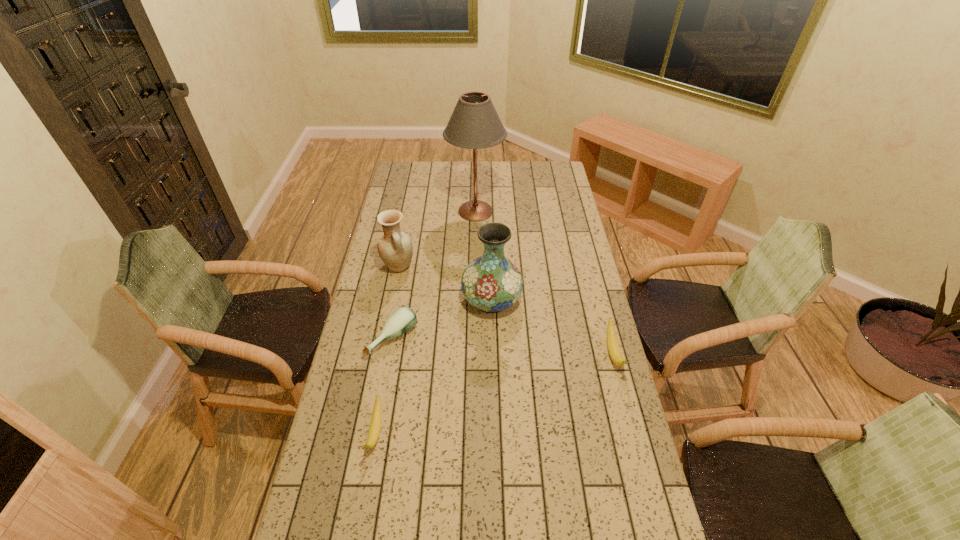
At what (x,y) coordinates should I click in order to perform the action: click on free space at the left edge of the desktop. Please return your answer as a coordinate pair (x, y). Looking at the image, I should click on pyautogui.click(x=365, y=295).

Identify the location of vacant region at the right edge. The image size is (960, 540). (636, 466).

In the image, there is a desktop. At what (x,y) coordinates should I click in order to perform the action: click on vacant space at the far left corner. Please return your answer as a coordinate pair (x, y). This screenshot has height=540, width=960. Looking at the image, I should click on (401, 170).

Locate an element on the screen. vacant space at the near left corner of the desktop is located at coordinates tap(324, 512).

This screenshot has width=960, height=540. Identify the location of blank region between the rightmost object and the bottle. (503, 346).

Find the location of a particular element. free space between the fifth shortest object and the third tallest object is located at coordinates (445, 283).

At what (x,y) coordinates should I click in order to perform the action: click on vacant space that is in between the bottle and the shorter banana. Please return your answer as a coordinate pair (x, y). Image resolution: width=960 pixels, height=540 pixels. Looking at the image, I should click on (384, 386).

The width and height of the screenshot is (960, 540). Identify the location of unoccupied area between the bottle and the rightmost object. (503, 346).

The width and height of the screenshot is (960, 540). I want to click on blank region between the pottery and the nearest object, so click(387, 349).

Where is `free space that is in between the bottle and the third tallest object`? free space that is in between the bottle and the third tallest object is located at coordinates (396, 302).